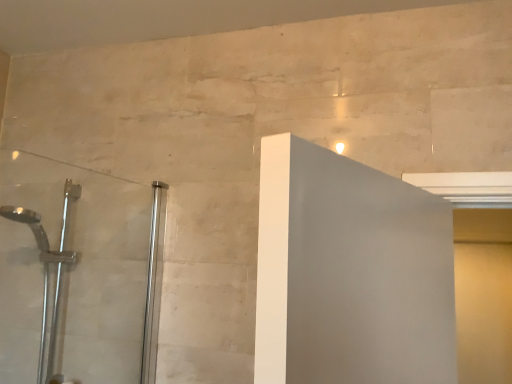
Question: From a real-world perspective, is matte yellow screen door at right positioned above or below silver metallic shower head at left?

Choices:
 (A) above
 (B) below

Answer: (B)

Question: Considering the positions of matte yellow screen door at right and silver metallic shower head at left in the image, is matte yellow screen door at right wider or thinner than silver metallic shower head at left?

Choices:
 (A) wide
 (B) thin

Answer: (B)

Question: Which object is the farthest from the clear glass shower door at left?

Choices:
 (A) silver metallic shower head at left
 (B) matte yellow screen door at right

Answer: (B)

Question: Estimate the real-world distances between objects in this image. Which object is farther from the matte yellow screen door at right?

Choices:
 (A) clear glass shower door at left
 (B) silver metallic shower head at left

Answer: (B)